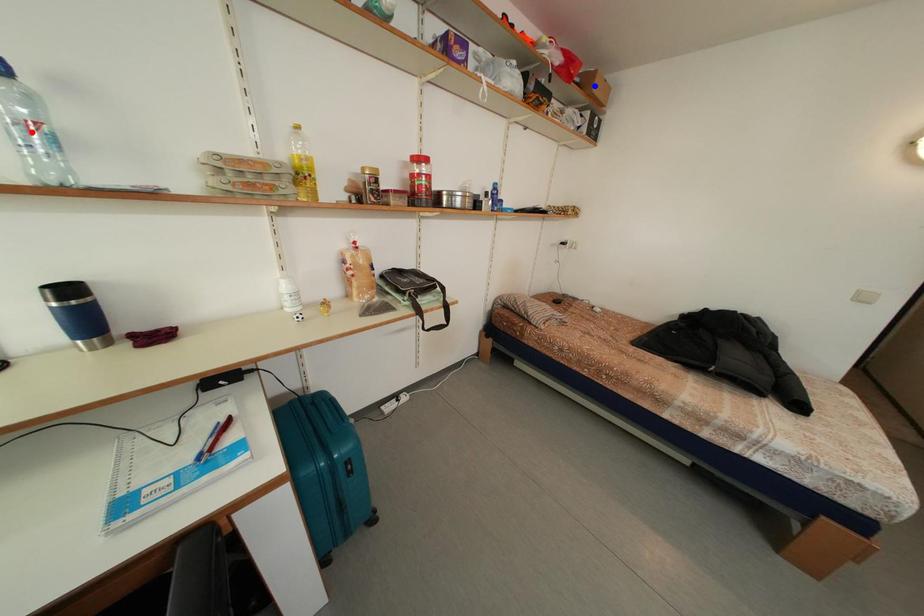
Question: In the image, two points are highlighted. Which point is nearer to the camera? Reply with the corresponding letter.

Choices:
 (A) blue point
 (B) red point

Answer: (B)